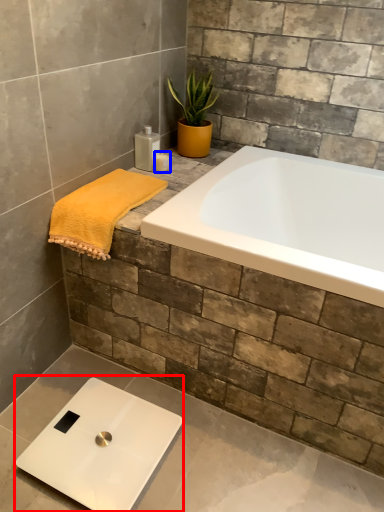
Question: Which object appears closest to the camera in this image, scale (highlighted by a red box) or toiletry (highlighted by a blue box)?

Choices:
 (A) scale
 (B) toiletry

Answer: (A)